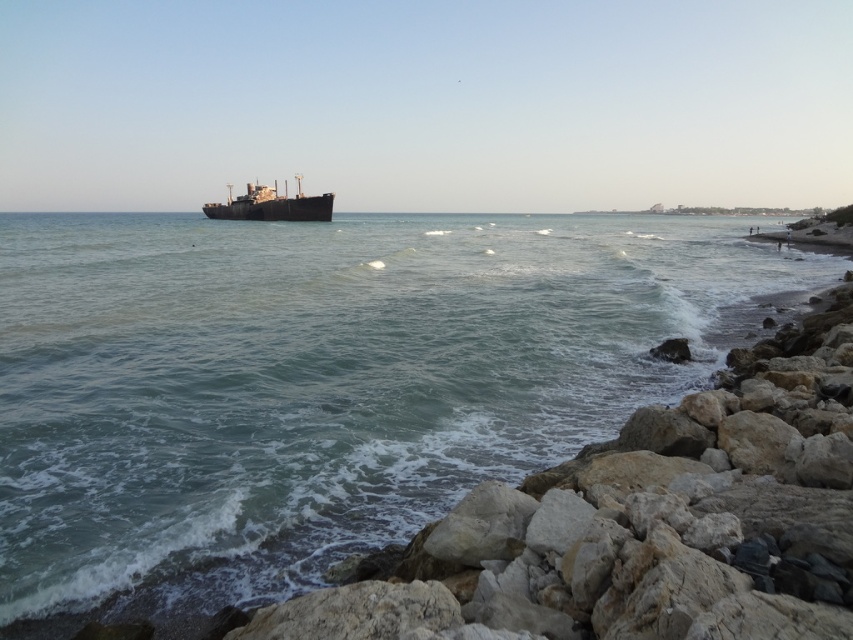
You are standing at the shoreline in the image and want to reach both the point at coordinates point (289,570) and point (312,205). Which point will you reach first as you walk straight ahead?

You will reach point (289,570) first because it is closer to the camera than point (312,205), meaning it is nearer to your current position at the shoreline.